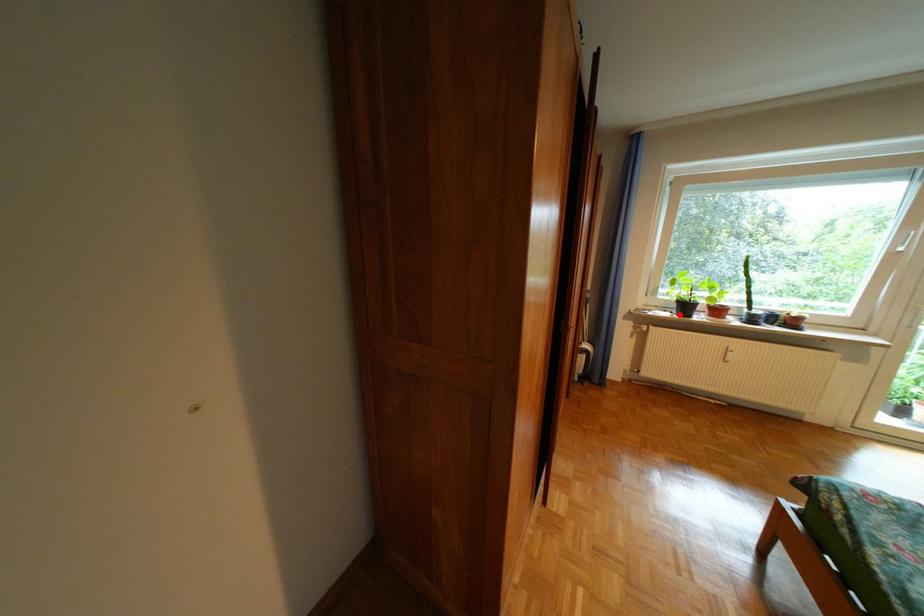
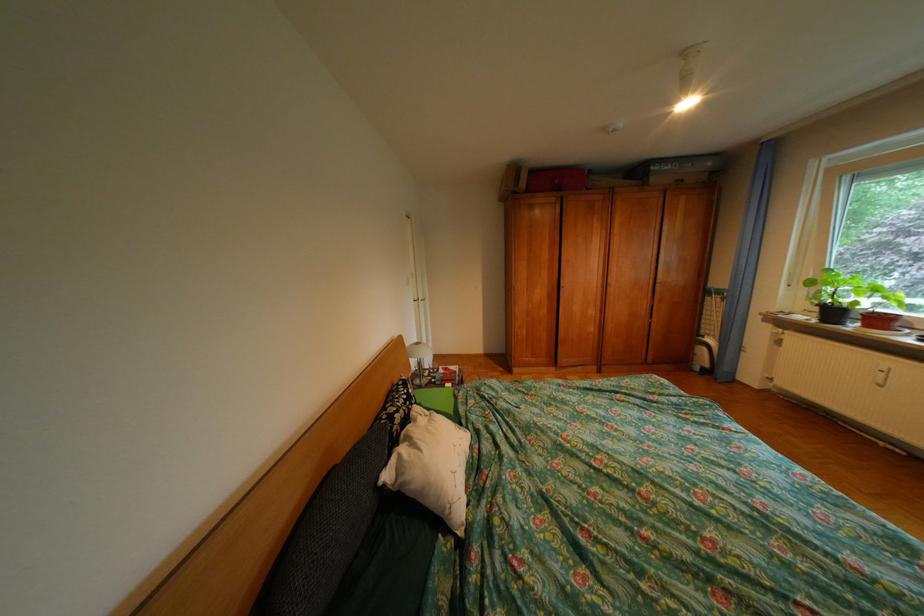
The point at the highlighted location is marked in the first image. Where is the corresponding point in the second image?

(819, 318)